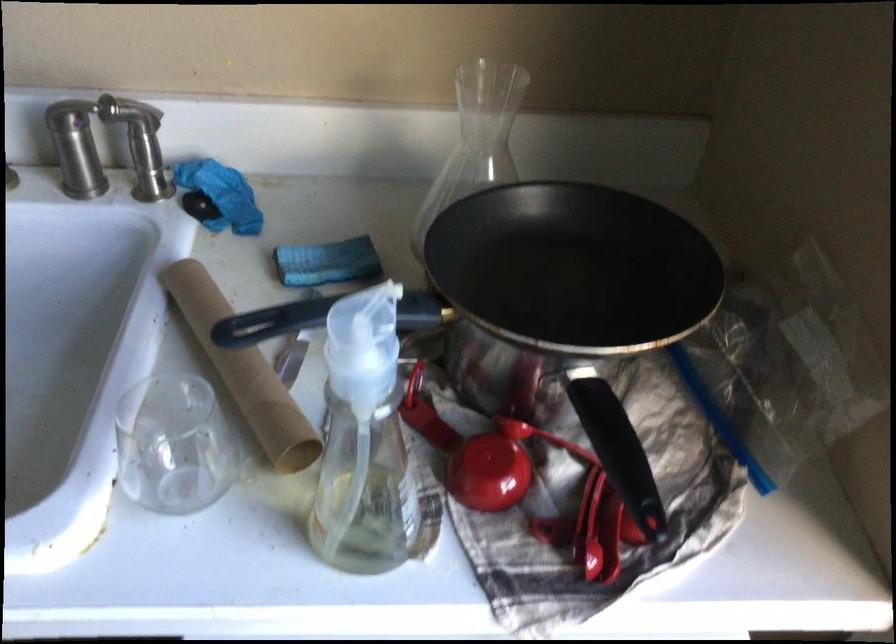
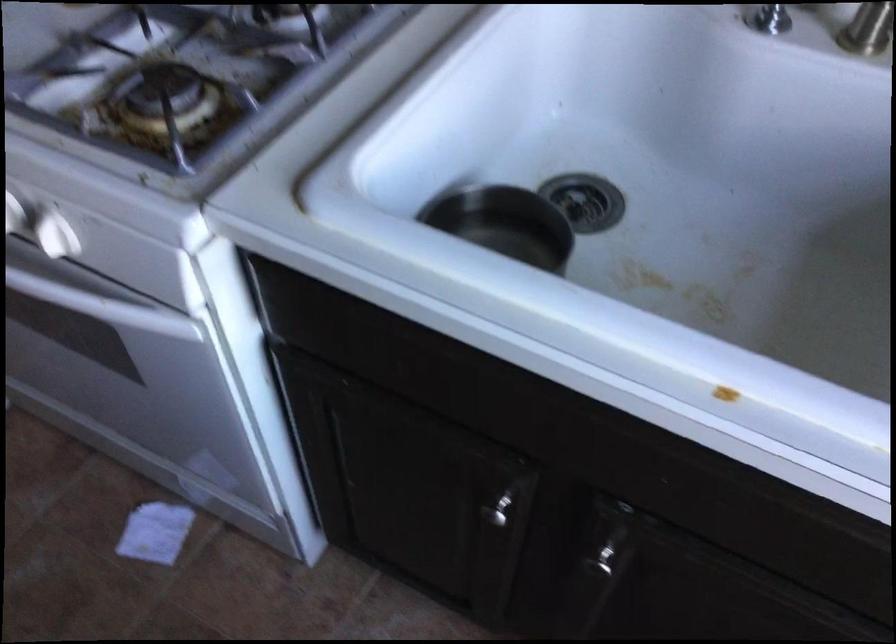
Question: How did the camera likely rotate?

Choices:
 (A) Left
 (B) Right
 (C) Up
 (D) Down

Answer: (A)